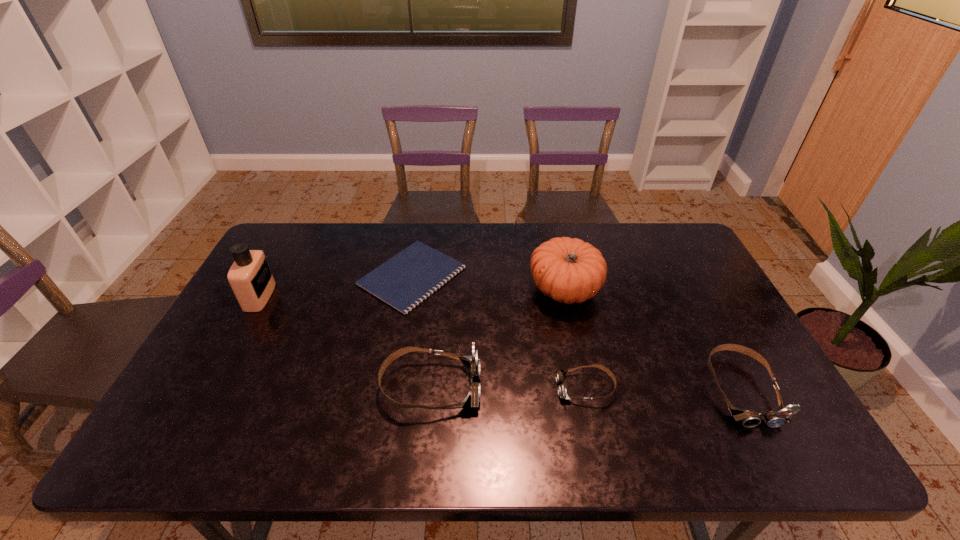
With all goggless evenly spaced, where should an extra goggles be placed on the left to continue the pattern? Please point out a vacant space. Please provide its 2D coordinates. Your answer should be formatted as a tuple, i.e. [(x, y)], where the tuple contains the x and y coordinates of a point satisfying the conditions above.

[(277, 386)]